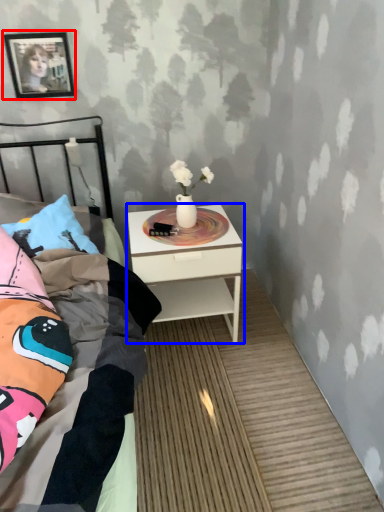
Question: Which object appears closest to the camera in this image, picture frame (highlighted by a red box) or nightstand (highlighted by a blue box)?

Choices:
 (A) picture frame
 (B) nightstand

Answer: (B)